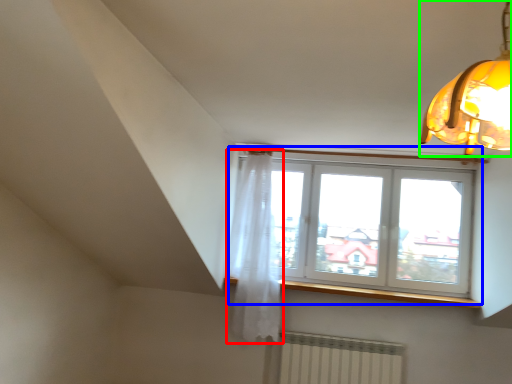
Question: Estimate the real-world distances between objects in this image. Which object is farther from curtain (highlighted by a red box), window (highlighted by a blue box) or lamp (highlighted by a green box)?

Choices:
 (A) window
 (B) lamp

Answer: (B)